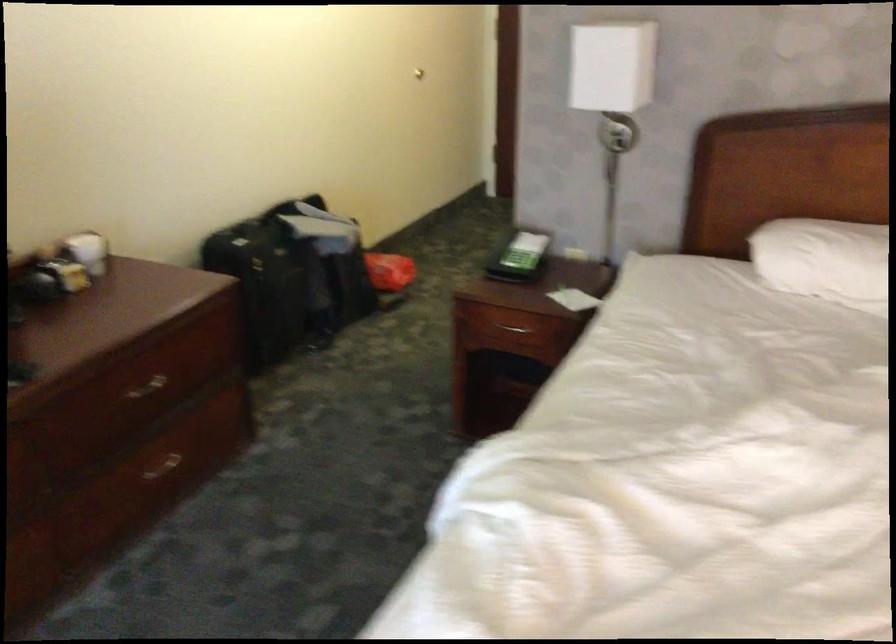
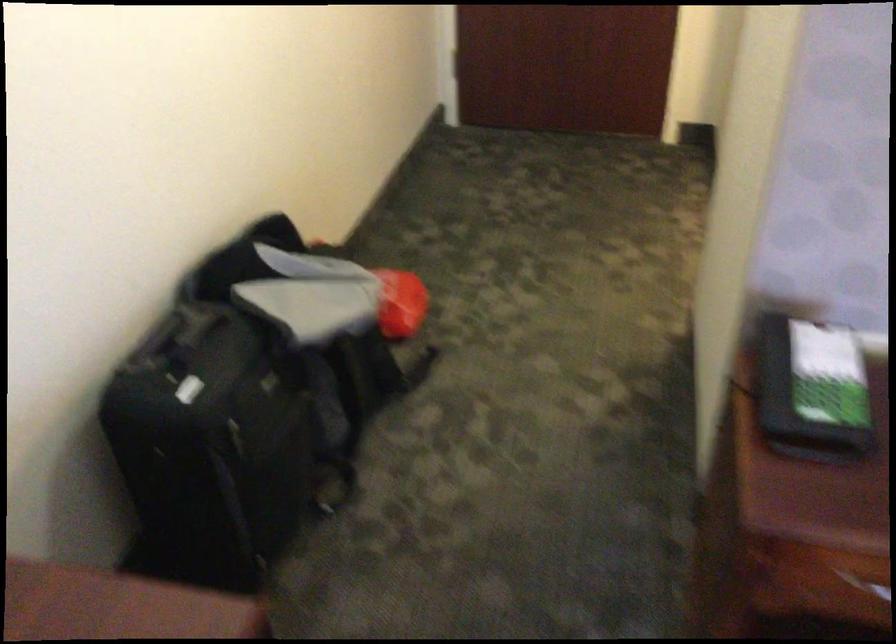
Locate, in the second image, the point that corresponds to (x=528, y=259) in the first image.

(812, 390)